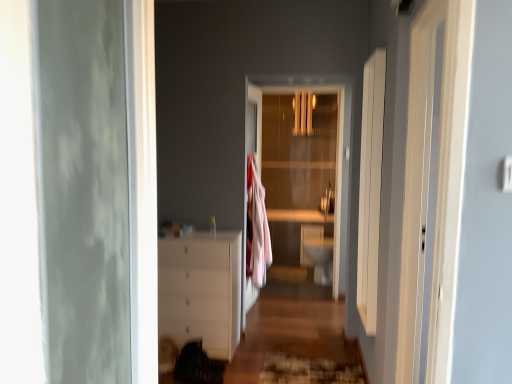
I want to click on free location in front of transparent glass door at center, so click(x=291, y=298).